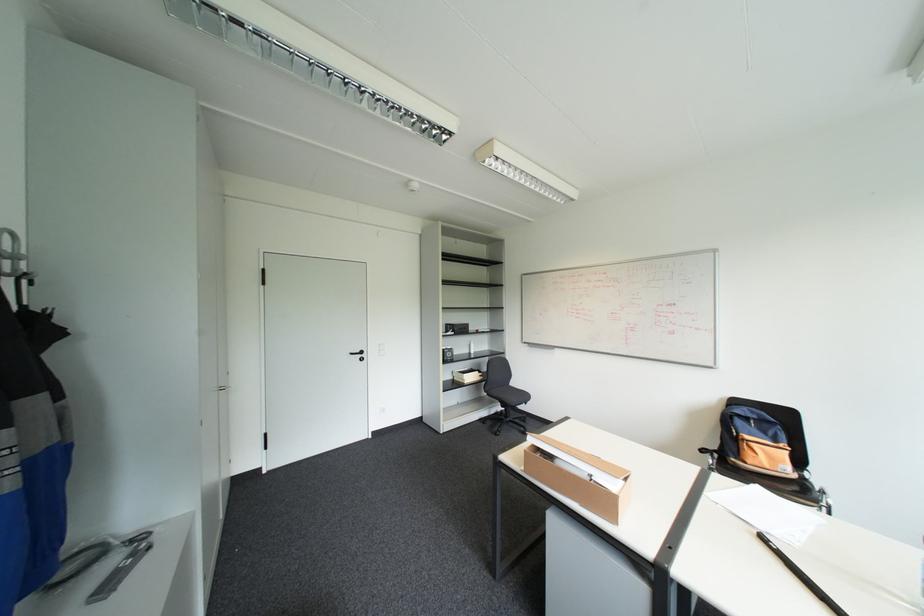
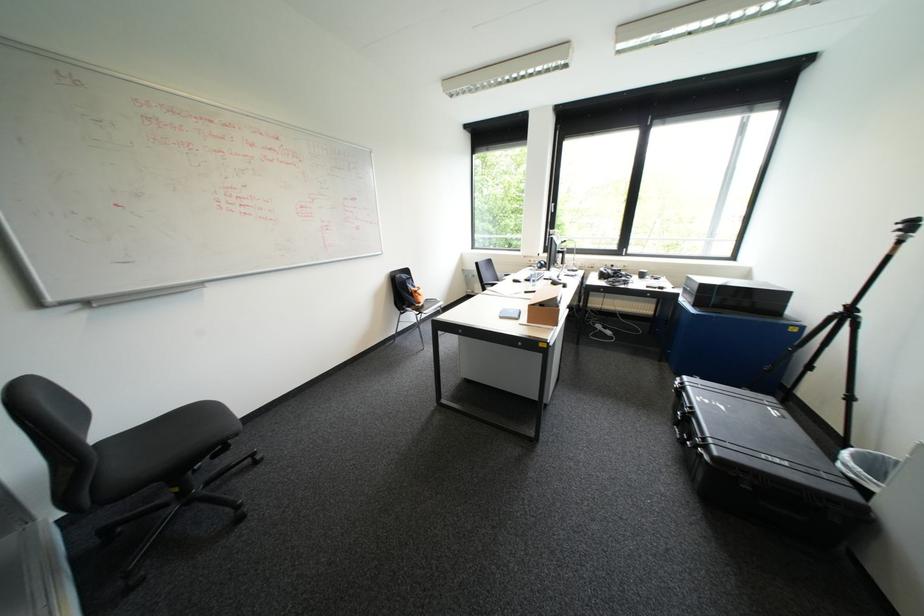
Question: I am providing you with two images of the same scene from different viewpoints. Which of the following objects are not visible in image2?

Choices:
 (A) textured glass vase
 (B) small wooden tray
 (C) black chair sitting surface
 (D) black case latch

Answer: (B)